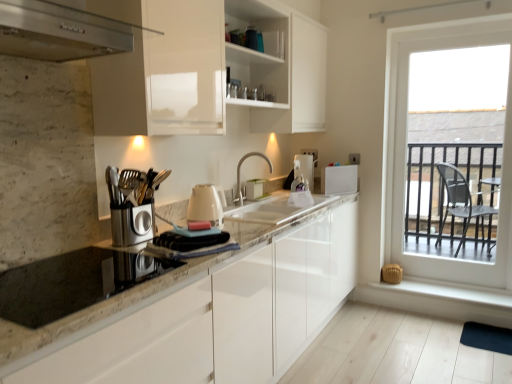
Image resolution: width=512 pixels, height=384 pixels. I want to click on free spot to the left of dark blue rubber mat at lower right, so click(435, 342).